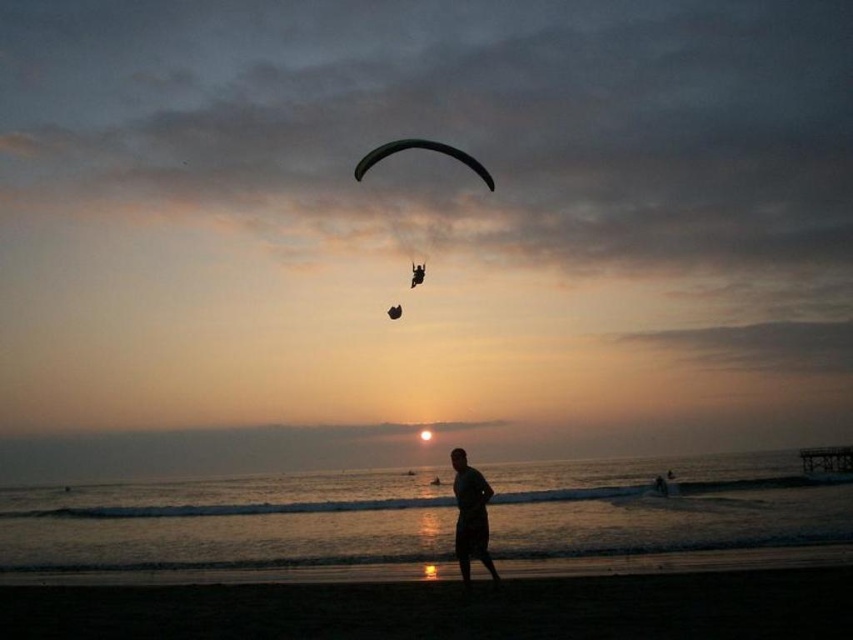
Question: Can you confirm if silhouette cotton shorts at center is positioned below green fabric parachute at upper center?

Choices:
 (A) no
 (B) yes

Answer: (B)

Question: Which of the following is the closest to the observer?

Choices:
 (A) (466, 544)
 (B) (421, 266)

Answer: (A)

Question: Which point is farther to the camera?

Choices:
 (A) green fabric parachute at upper center
 (B) silhouette cotton shorts at center

Answer: (A)

Question: Is silhouette cotton shorts at center positioned behind green fabric parachute at upper center?

Choices:
 (A) no
 (B) yes

Answer: (A)

Question: Does silhouette cotton shorts at center appear on the right side of green fabric parachute at upper center?

Choices:
 (A) yes
 (B) no

Answer: (A)